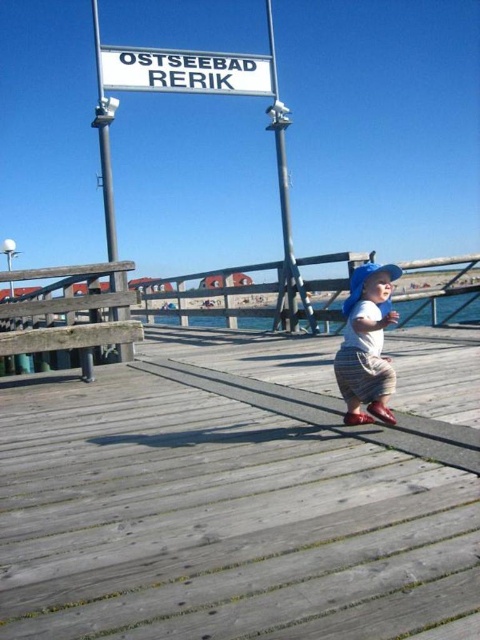
Question: Does gray wooden dock at center have a smaller size compared to matte blue hat at center?

Choices:
 (A) yes
 (B) no

Answer: (B)

Question: Which object appears closest to the camera in this image?

Choices:
 (A) matte blue hat at center
 (B) white plastic sign at upper center

Answer: (A)

Question: Does gray wooden dock at center appear over matte blue hat at center?

Choices:
 (A) yes
 (B) no

Answer: (B)

Question: Which point appears closest to the camera in this image?

Choices:
 (A) (128, 307)
 (B) (137, 60)

Answer: (A)

Question: Which object appears farthest from the camera in this image?

Choices:
 (A) white plastic sign at upper center
 (B) matte blue hat at center

Answer: (A)

Question: Is gray wooden dock at center in front of white plastic sign at upper center?

Choices:
 (A) no
 (B) yes

Answer: (B)